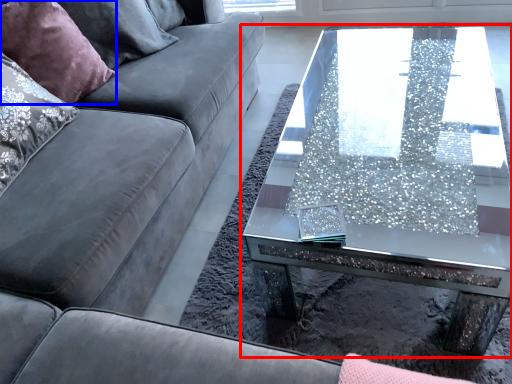
Question: Which object is closer to the camera taking this photo, coffee table (highlighted by a red box) or pillow (highlighted by a blue box)?

Choices:
 (A) coffee table
 (B) pillow

Answer: (A)